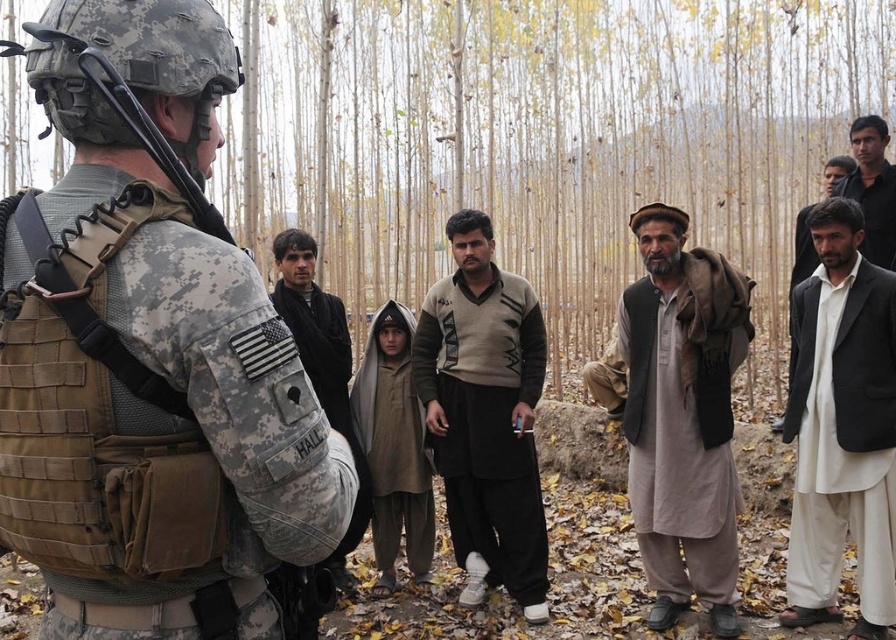
You are a photographer positioned 10 feet behind the soldier. You want to take a photo that includes both the white cotton kurta at right and the dark brown wool sweater at center without moving the subjects. Is the current distance between them sufficient to fit both into your camera frame if your camera has a maximum field of view of 10 feet?

The distance between the white cotton kurta at right and the dark brown wool sweater at center is 7.02 feet, which is less than the camera field of view of 10 feet. Therefore, both can be captured in a single frame without moving the subjects.

You are a drone operator trying to capture two specific points in the image. The first point is at coordinate point (652, 394) and the second is at point (873, 204). Which point is nearer to your drone camera?

Point (652, 394) is closer to the camera than point (873, 204).